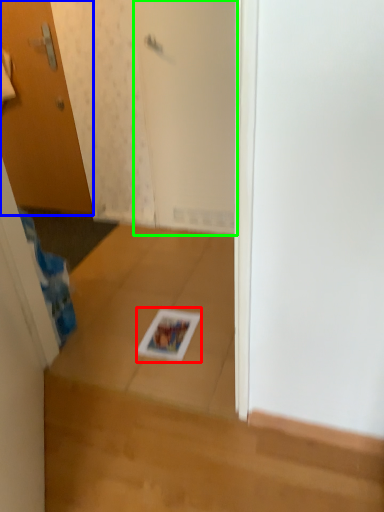
Question: Which is farther away from magazine (highlighted by a red box)? door (highlighted by a blue box) or screen door (highlighted by a green box)?

Choices:
 (A) door
 (B) screen door

Answer: (A)